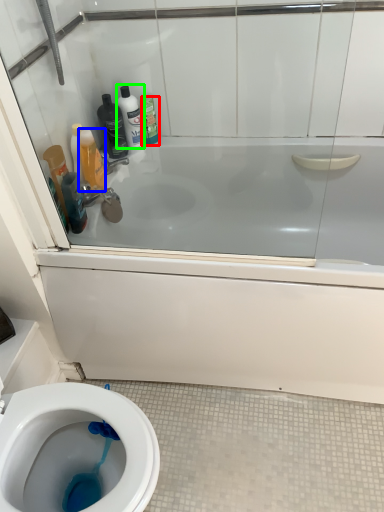
Question: Which is nearer to the cleaning product (highlighted by a red box)? cleaning product (highlighted by a blue box) or cleaning product (highlighted by a green box).

Choices:
 (A) cleaning product
 (B) cleaning product

Answer: (B)